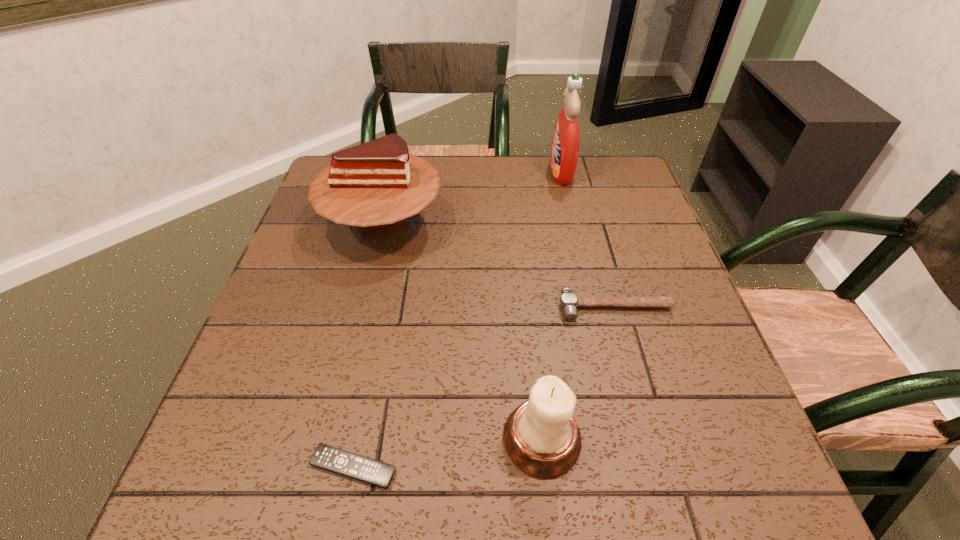
The image size is (960, 540). Identify the location of empty space that is in between the second tallest object and the third tallest object. (463, 331).

This screenshot has height=540, width=960. I want to click on empty space between the third tallest object and the remote control, so click(447, 453).

Find the location of a particular element. The image size is (960, 540). empty space between the fourth nearest object and the third tallest object is located at coordinates (463, 331).

The height and width of the screenshot is (540, 960). What are the coordinates of `free point between the fourth shortest object and the hammer` in the screenshot? It's located at (499, 265).

In order to click on free space between the second shortest object and the detergent in this screenshot , I will do `click(588, 239)`.

Where is `empty space that is in between the third object from left to right and the detergent`? Image resolution: width=960 pixels, height=540 pixels. empty space that is in between the third object from left to right and the detergent is located at coordinates (552, 305).

Find the location of a particular element. free area in between the third object from right to left and the third farthest object is located at coordinates (578, 373).

The image size is (960, 540). I want to click on free area in between the shortest object and the candle holder, so click(x=447, y=453).

Identify the location of the closest object relative to the third farthest object. The width and height of the screenshot is (960, 540). (541, 437).

Locate which object is the fourth closest to the shortest object. Please provide its 2D coordinates. Your answer should be formatted as a tuple, i.e. [(x, y)], where the tuple contains the x and y coordinates of a point satisfying the conditions above.

[(566, 138)]